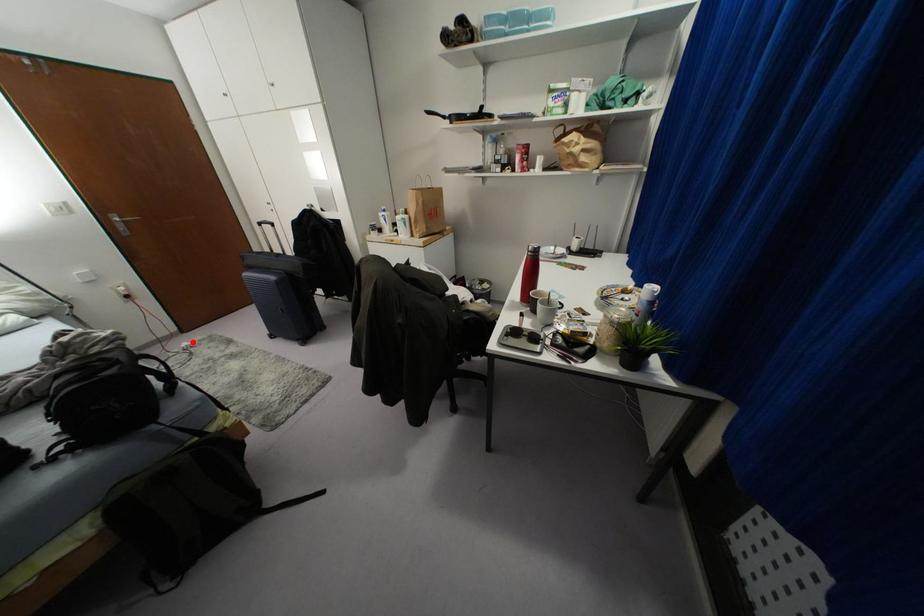
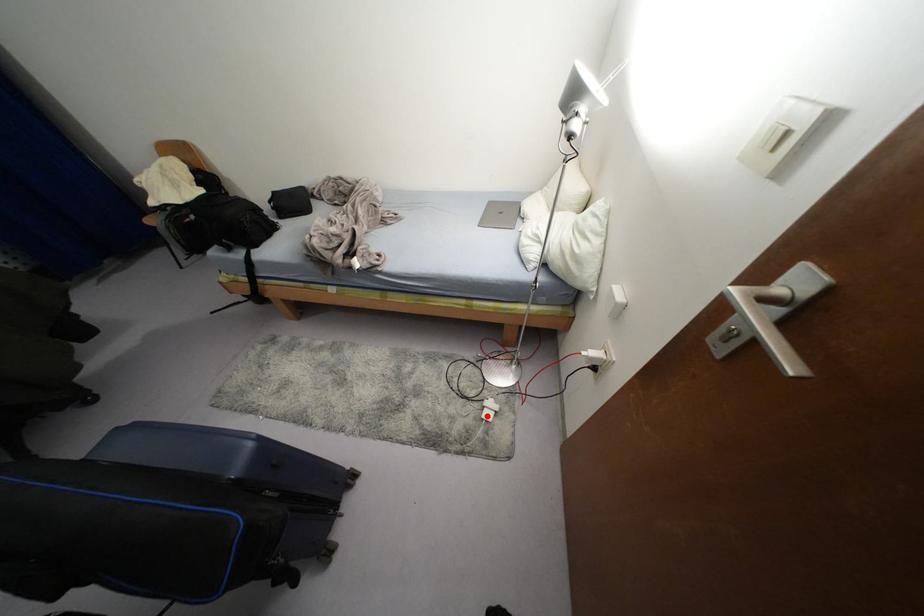
I am providing you with two images of the same scene from different viewpoints. A red point is marked on the first image and another point is marked on the second image. Is the marked point in image1 the same physical position as the marked point in image2?

Yes